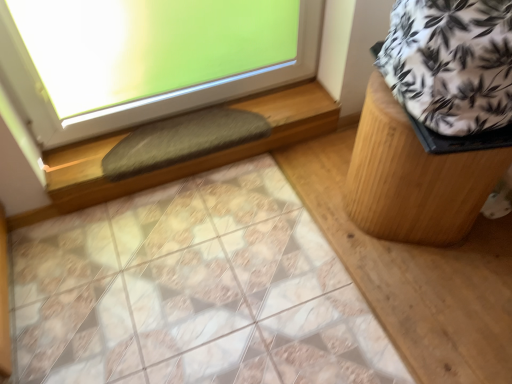
Question: Is gray fuzzy mat at lower center positioned with its back to white printed fabric at upper right?

Choices:
 (A) no
 (B) yes

Answer: (A)

Question: Is gray fuzzy mat at lower center oriented towards white printed fabric at upper right?

Choices:
 (A) yes
 (B) no

Answer: (B)

Question: Is white printed fabric at upper right located within gray fuzzy mat at lower center?

Choices:
 (A) no
 (B) yes

Answer: (A)

Question: From the image's perspective, is gray fuzzy mat at lower center above white printed fabric at upper right?

Choices:
 (A) yes
 (B) no

Answer: (B)

Question: From a real-world perspective, is gray fuzzy mat at lower center physically below white printed fabric at upper right?

Choices:
 (A) yes
 (B) no

Answer: (A)

Question: Can you see gray fuzzy mat at lower center touching white printed fabric at upper right?

Choices:
 (A) no
 (B) yes

Answer: (A)

Question: Is green felt at upper left to the right of white printed fabric at upper right from the viewer's perspective?

Choices:
 (A) yes
 (B) no

Answer: (B)

Question: Is green felt at upper left aimed at white printed fabric at upper right?

Choices:
 (A) no
 (B) yes

Answer: (A)

Question: From the image's perspective, does green felt at upper left appear lower than white printed fabric at upper right?

Choices:
 (A) yes
 (B) no

Answer: (A)

Question: Considering the relative sizes of green felt at upper left and white printed fabric at upper right in the image provided, is green felt at upper left thinner than white printed fabric at upper right?

Choices:
 (A) no
 (B) yes

Answer: (B)

Question: Is green felt at upper left positioned with its back to white printed fabric at upper right?

Choices:
 (A) yes
 (B) no

Answer: (B)

Question: Does green felt at upper left have a greater width compared to white printed fabric at upper right?

Choices:
 (A) no
 (B) yes

Answer: (A)

Question: From a real-world perspective, is white printed fabric at upper right under green felt at upper left?

Choices:
 (A) yes
 (B) no

Answer: (B)